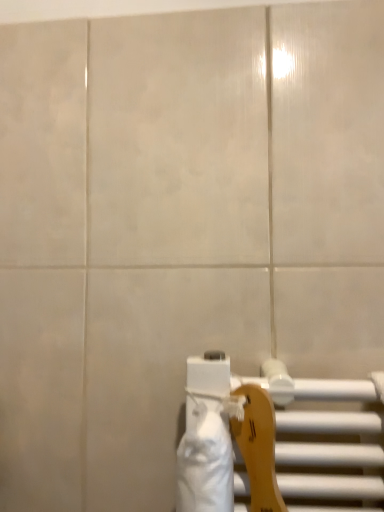
Find the location of `white matte toilet paper at lower right`. white matte toilet paper at lower right is located at coordinates (205, 460).

Describe the element at coordinates (205, 460) in the screenshot. I see `white matte toilet paper at lower right` at that location.

I want to click on white matte toilet paper at lower right, so click(205, 460).